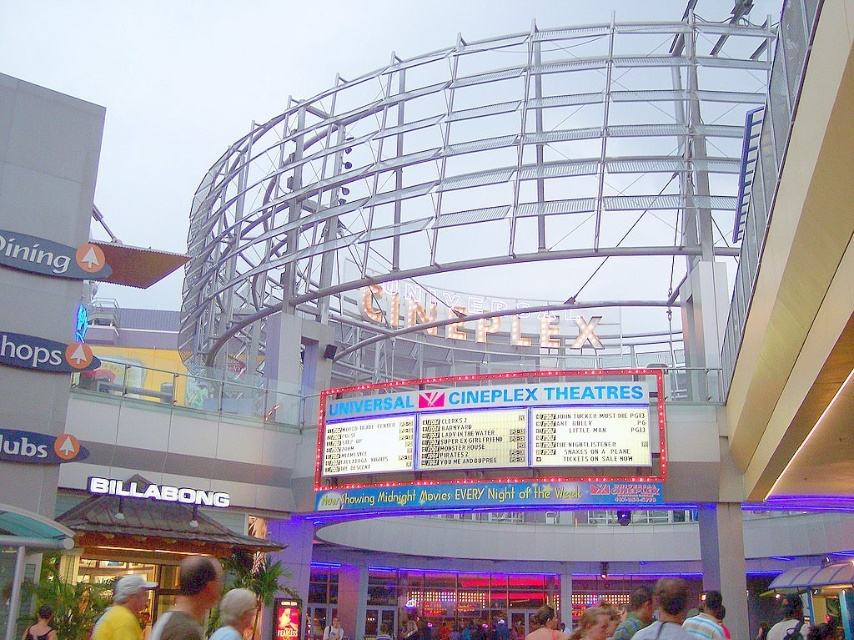
Question: Does red plastic marquee at center come in front of dark brown hair at lower left?

Choices:
 (A) yes
 (B) no

Answer: (B)

Question: Estimate the real-world distances between objects in this image. Which object is closer to the matte pink shirt at center?

Choices:
 (A) white hair at center
 (B) dark brown hair at lower left
 (C) light blue shirt at lower right

Answer: (C)

Question: Does yellow fabric at lower left appear under dark brown hair at lower left?

Choices:
 (A) yes
 (B) no

Answer: (A)

Question: Estimate the real-world distances between objects in this image. Which object is farther from the blonde hair at center?

Choices:
 (A) red plastic marquee at center
 (B) smooth skin face at center
 (C) light blue shirt at lower right

Answer: (B)

Question: Among these points, which one is nearest to the camera?

Choices:
 (A) (803, 632)
 (B) (711, 593)
 (C) (659, 579)
 (D) (553, 637)

Answer: (D)

Question: Does gray hair at center have a lesser width compared to yellow fabric at lower left?

Choices:
 (A) no
 (B) yes

Answer: (A)